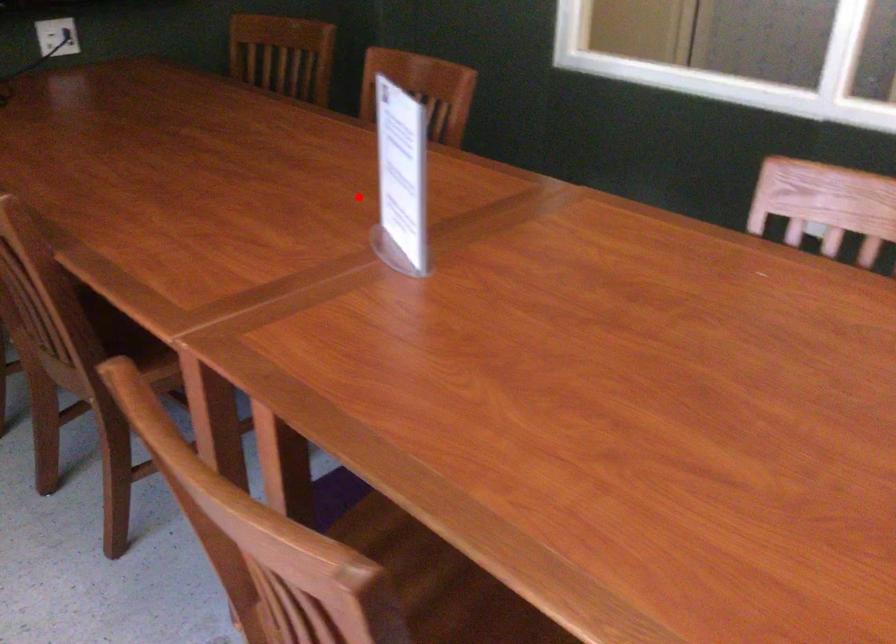
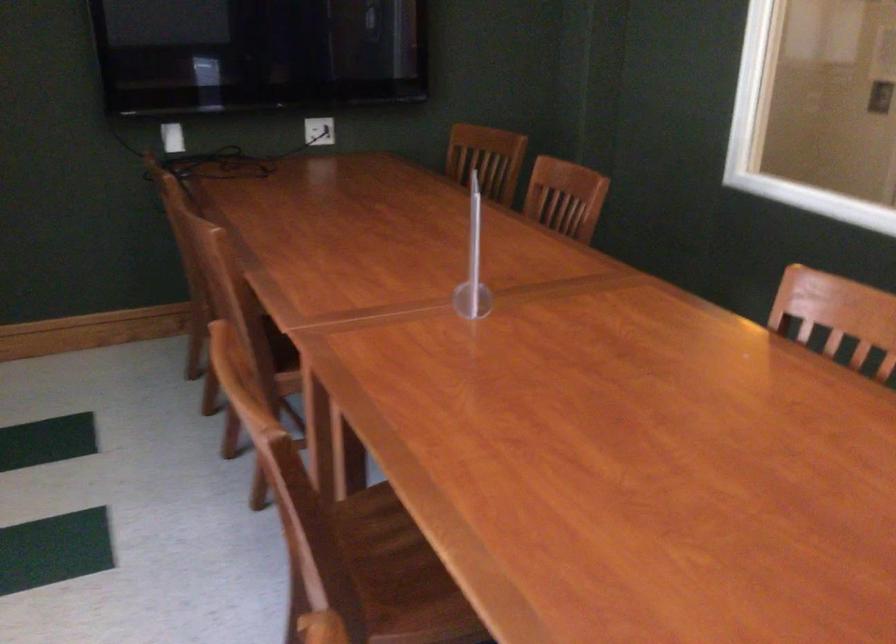
Question: I am providing you with two images of the same scene from different viewpoints. Given a red point in image1, look at the same physical point in image2. Is it:

Choices:
 (A) Closer to the viewpoint
 (B) Farther from the viewpoint

Answer: (B)